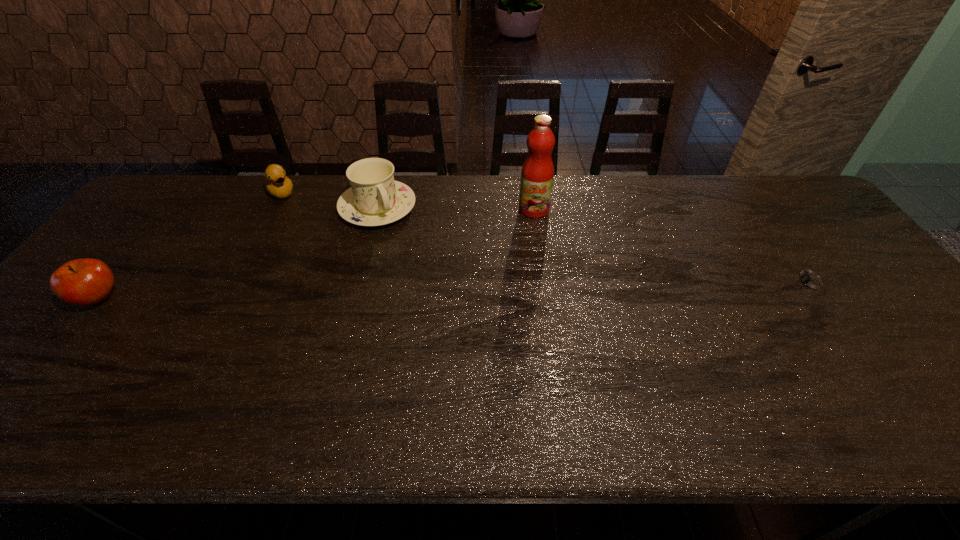
Locate an element on the screen. The width and height of the screenshot is (960, 540). the leftmost object is located at coordinates (84, 282).

Locate an element on the screen. The width and height of the screenshot is (960, 540). watch is located at coordinates (811, 283).

You are a GUI agent. You are given a task and a screenshot of the screen. Output one action in this format:
    pyautogui.click(x=<x>, y=<y>)
    Task: Click on the shortest object
    
    Given the screenshot: What is the action you would take?
    pyautogui.click(x=811, y=283)

I want to click on the second object from right to left, so click(x=537, y=174).

I want to click on the tallest object, so click(x=537, y=174).

Where is `the third object from right to left`? Image resolution: width=960 pixels, height=540 pixels. the third object from right to left is located at coordinates (374, 199).

Locate an element on the screen. the second object from left to right is located at coordinates (277, 183).

Identify the location of free space located 0.390m on the right of the leftmost object. The height and width of the screenshot is (540, 960). (276, 299).

Find the location of a particular element. The width and height of the screenshot is (960, 540). vacant space located on the face of the shortest object is located at coordinates (636, 283).

Locate an element on the screen. This screenshot has width=960, height=540. free space located 0.360m on the face of the shortest object is located at coordinates (652, 283).